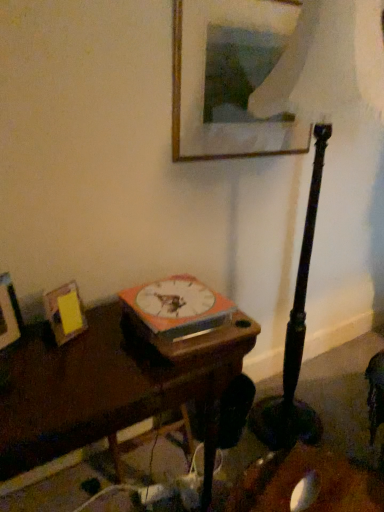
Question: From a real-world perspective, is yellow paper at left, the 2th picture frame viewed from the right, physically located above or below orange matte book at center?

Choices:
 (A) below
 (B) above

Answer: (A)

Question: From the image's perspective, is yellow paper at left, arranged as the 2th picture frame when ordered from the bottom, positioned above or below orange matte book at center?

Choices:
 (A) above
 (B) below

Answer: (B)

Question: Considering the real-world distances, which object is farthest from the wooden picture frame at upper center, marked as the 1th picture frame in a top-to-bottom arrangement?

Choices:
 (A) dark wood table at center
 (B) wooden photo frame at left, the first picture frame in the left-to-right sequence
 (C) orange matte book at center
 (D) yellow paper at left, the second picture frame when ordered from top to bottom
 (E) matte black lamp at center

Answer: (B)

Question: Estimate the real-world distances between objects in this image. Which object is farther from the dark wood table at center?

Choices:
 (A) matte black lamp at center
 (B) orange matte book at center
 (C) wooden picture frame at upper center, acting as the 1th picture frame starting from the right
 (D) yellow paper at left, the second picture frame when ordered from top to bottom
 (E) wooden photo frame at left, the first picture frame in the left-to-right sequence

Answer: (C)